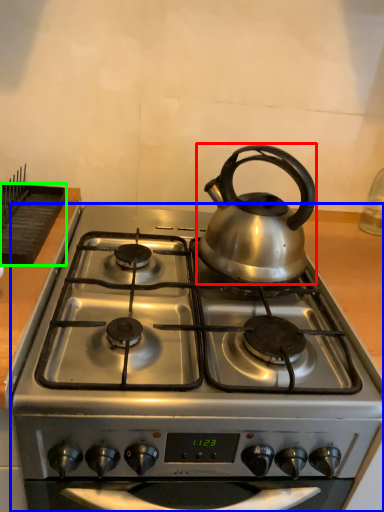
Question: Considering the real-world distances, which object is closest to kettle (highlighted by a red box)? gas stove (highlighted by a blue box) or kitchen appliance (highlighted by a green box).

Choices:
 (A) gas stove
 (B) kitchen appliance

Answer: (A)